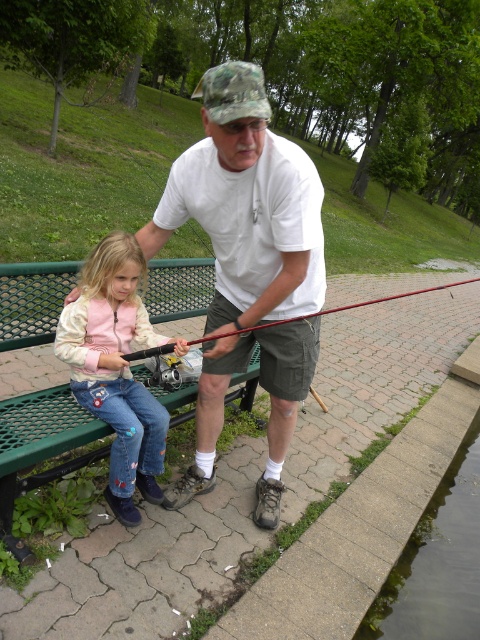
You are standing at the point labeled as point (117, 369) in the image. What object is located at this coordinate?

The point (117, 369) corresponds to denim jeans at left.

You are a photographer trying to capture a candid shot of the adult male in the scene. You notice the white matte shirt at center and denim jeans at left. Which clothing item is closer to the camera?

The white matte shirt at center is positioned over denim jeans at left, so the white matte shirt at center is closer to the camera.